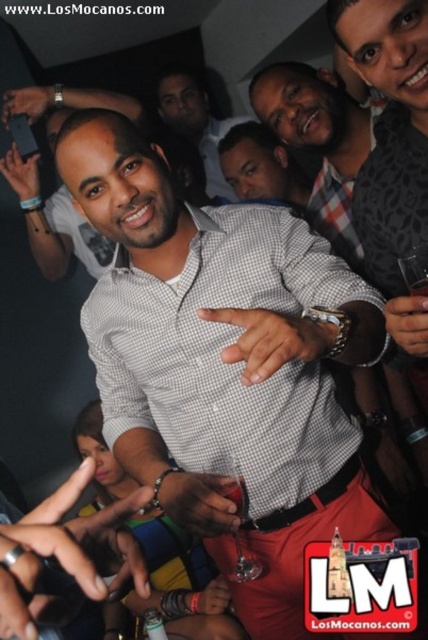
In the scene shown: You are at a party and need to decide which of the two shirts at the center is bigger. The white checkered shirt at center and the matte gray shirt at center are both in your view. Which one is bigger?

The white checkered shirt at center is larger in size than the matte gray shirt at center, so the white checkered shirt at center is bigger.

You are standing at the entrance of the event and want to approach the man in the checkered shirt at center. Considering the distance between you and him, can you estimate if you can reach him in 3 seconds if you walk at a normal pace?

The distance between you and the checkered shirt at center is 1.69 meters. At a normal walking speed of about 1.4 meters per second, you would cover 4.2 meters in 3 seconds, which is more than enough to cover the 1.69 meters. Therefore, you can easily reach him in less than 3 seconds.

You are standing at the center of the gathering and notice two points in the image. The first point is labeled as point (324, 83) and the second is point (265, 134). Which of these points is closer to you?

Point (324, 83) is in front of point (265, 134), so it is closer to you.